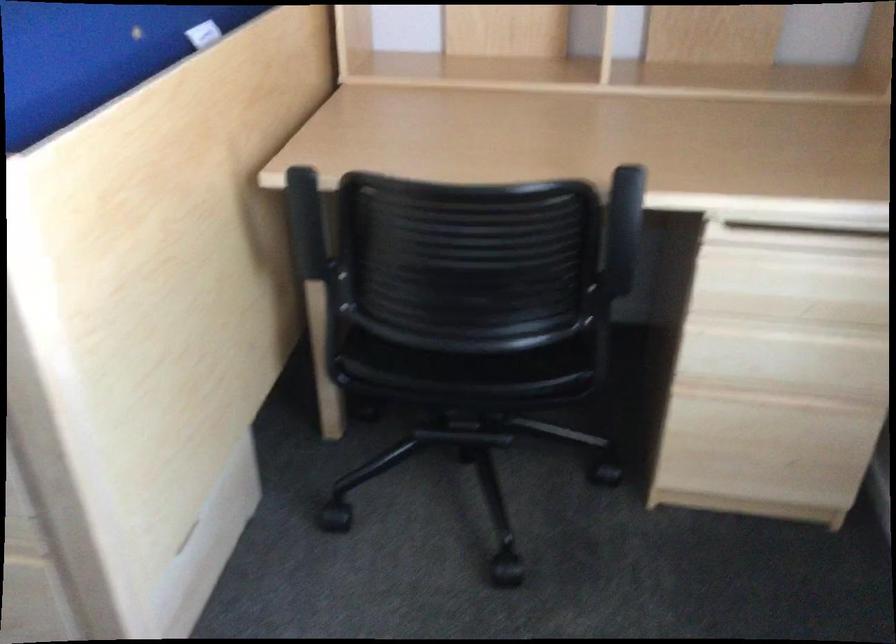
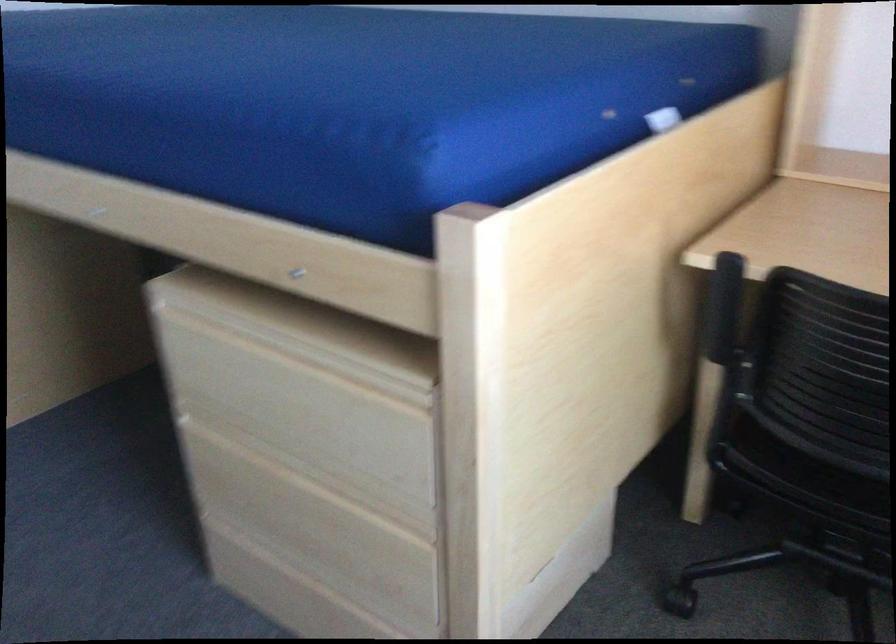
In a continuous first-person perspective shot, in which direction is the camera moving?

Result: The cameraman moved toward left, backward.